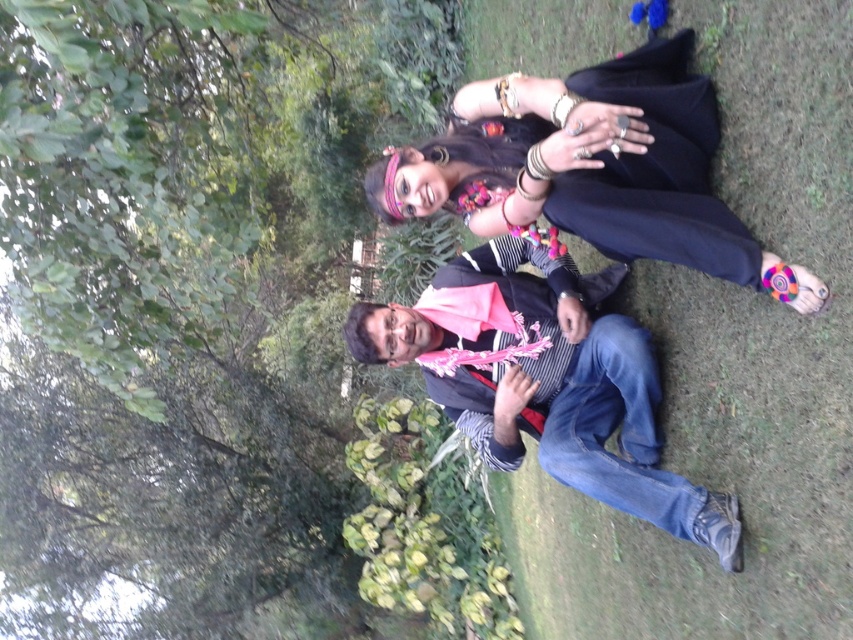
Which of these two, black fabric dress at upper center or striped fabric scarf at center, stands shorter?

black fabric dress at upper center

Does point (647, 122) lie in front of point (503, 406)?

Yes, point (647, 122) is closer to viewer.

I want to click on black fabric dress at upper center, so click(590, 168).